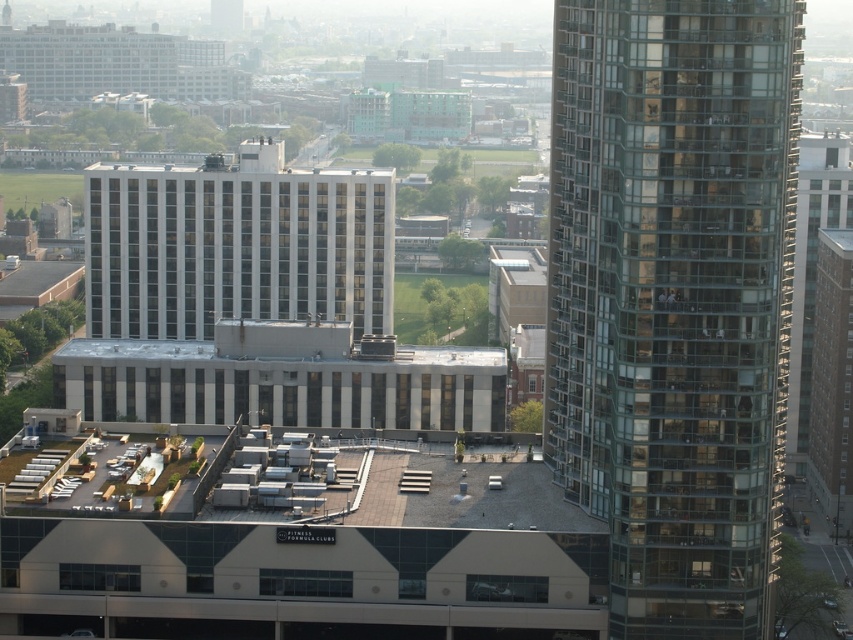
Question: Which point is closer to the camera?

Choices:
 (A) transparent glass building at right
 (B) white matte building at center

Answer: (A)

Question: Can you confirm if transparent glass building at right is positioned to the left of white matte building at center?

Choices:
 (A) yes
 (B) no

Answer: (B)

Question: Considering the relative positions of transparent glass building at right and white matte building at center in the image provided, where is transparent glass building at right located with respect to white matte building at center?

Choices:
 (A) right
 (B) left

Answer: (A)

Question: Among these objects, which one is farthest from the camera?

Choices:
 (A) white matte building at center
 (B) transparent glass building at right

Answer: (A)

Question: Can you confirm if transparent glass building at right is positioned above white matte building at center?

Choices:
 (A) no
 (B) yes

Answer: (A)